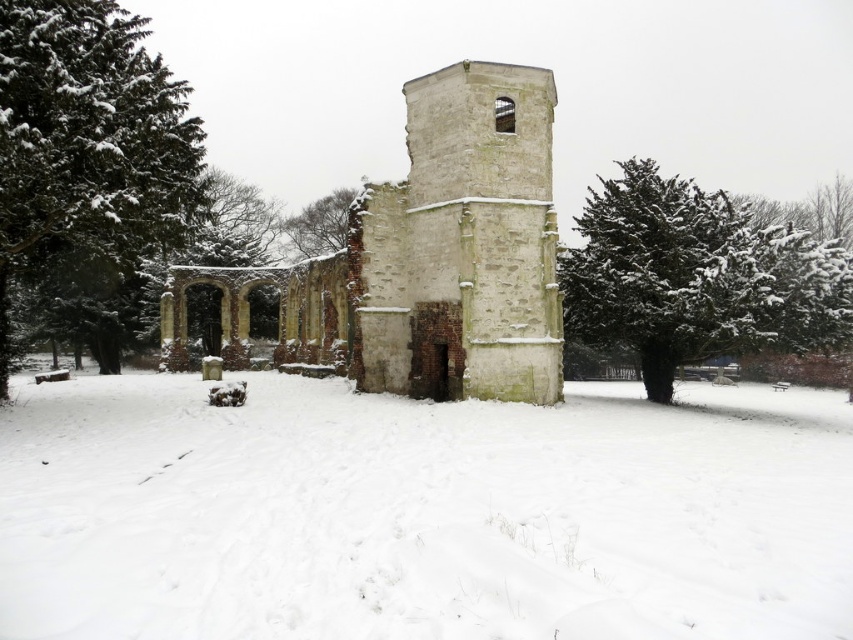
Does stone church at center come behind snow-covered evergreen at center?

No, it is in front of snow-covered evergreen at center.

The width and height of the screenshot is (853, 640). What do you see at coordinates (426, 257) in the screenshot? I see `stone church at center` at bounding box center [426, 257].

Which is in front, point (383, 323) or point (662, 307)?

Positioned in front is point (383, 323).

The image size is (853, 640). I want to click on stone church at center, so click(426, 257).

Can you confirm if stone church at center is taller than snow-covered branches at center?

Correct, stone church at center is much taller as snow-covered branches at center.

Based on the photo, which is more to the left, stone church at center or snow-covered branches at center?

snow-covered branches at center is more to the left.

What do you see at coordinates (426, 257) in the screenshot?
I see `stone church at center` at bounding box center [426, 257].

Where is `stone church at center`? stone church at center is located at coordinates (426, 257).

Who is positioned more to the left, white fluffy snow at center or green textured pine tree at left?

From the viewer's perspective, green textured pine tree at left appears more on the left side.

Between point (267, 595) and point (132, 253), which one is positioned in front?

Point (267, 595) is more forward.

The image size is (853, 640). I want to click on white fluffy snow at center, so click(421, 513).